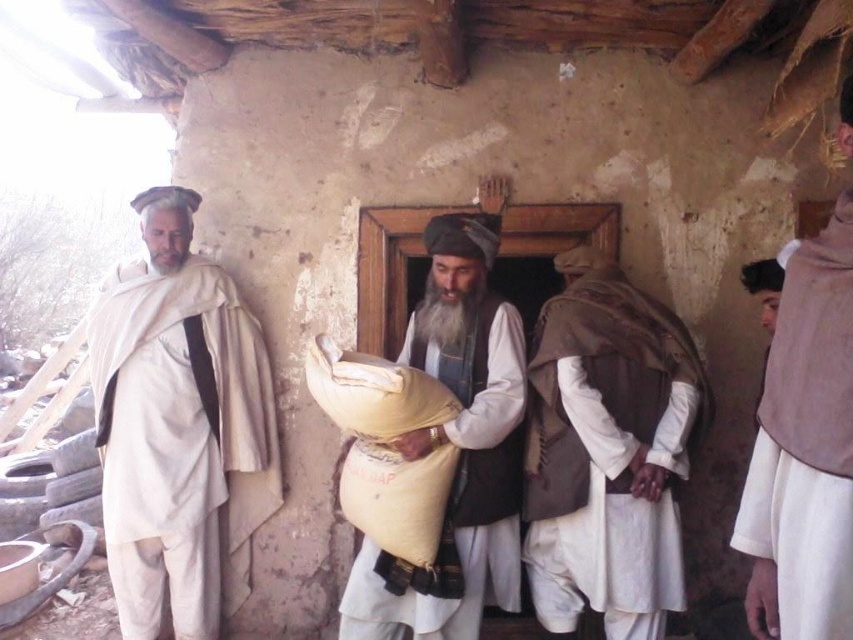
You are standing in front of the rustic building and want to greet both the person wearing white matte clothing at left and the person wearing brown textured vest at right. Which individual should you approach first based on their position relative to you?

You should approach the person wearing white matte clothing at left first because they are closer to you compared to the person wearing brown textured vest at right who is further away.

You are a traveler who needs to determine which item is bigger between the yellow fabric sack at center and the white cotton robe at right. Can you tell me which one is bigger?

The yellow fabric sack at center is larger in size than the white cotton robe at right.